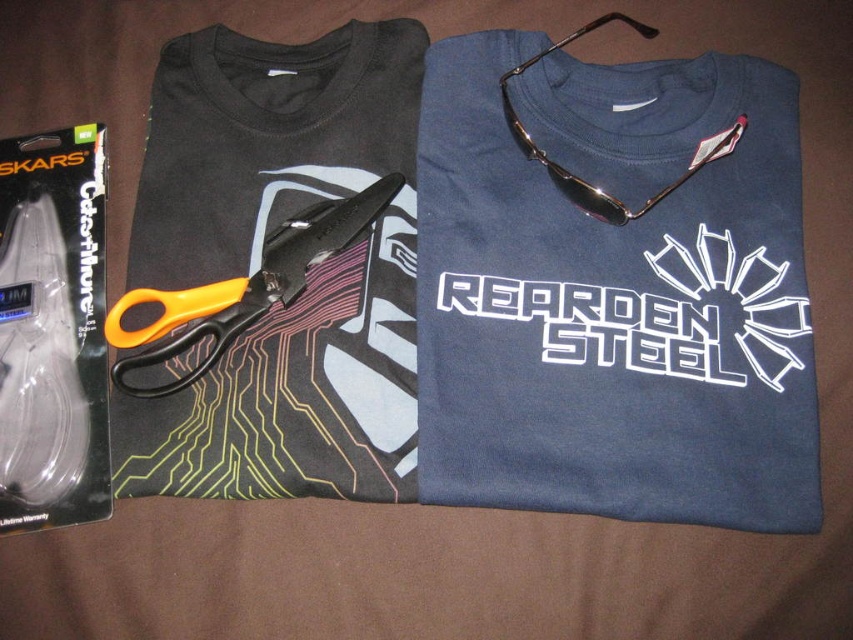
You are trying to determine which object is wider between the white glossy text at center and the metallic gold sunglasses at upper center. Based on the scene, which one has a greater width?

The white glossy text at center is wider than the metallic gold sunglasses at upper center according to the description.

You are trying to place a 6.5 inch ruler between the white glossy text at center and the metallic gold sunglasses at upper center. Will the ruler fit entirely between them?

The distance between the white glossy text at center and the metallic gold sunglasses at upper center is 7.18 inches. Since the ruler is 6.5 inches long, it will fit entirely between them with some space to spare.